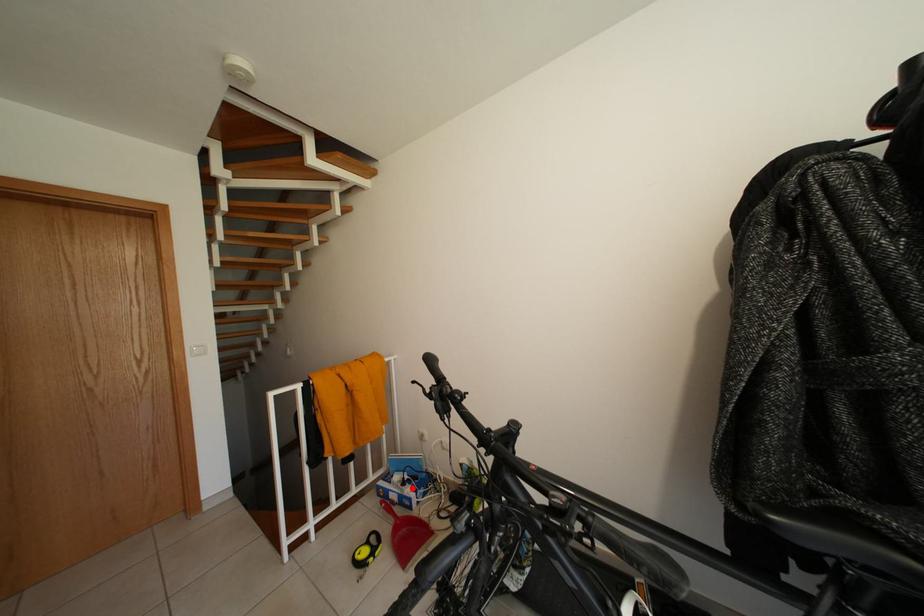
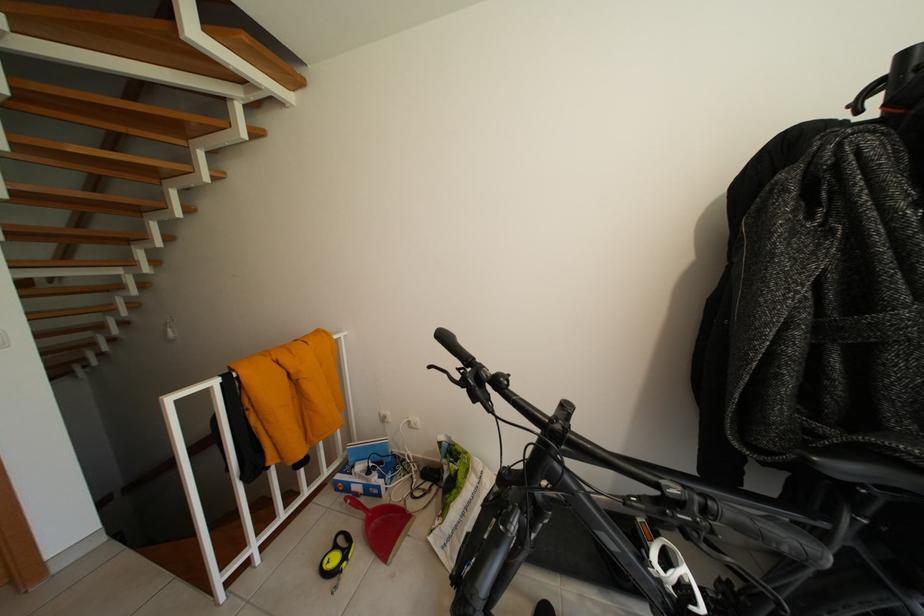
Question: I am providing you with two images of the same scene from different viewpoints. Given a red point in image1, look at the same physical point in image2. Is it:

Choices:
 (A) Closer to the viewpoint
 (B) Farther from the viewpoint

Answer: (A)